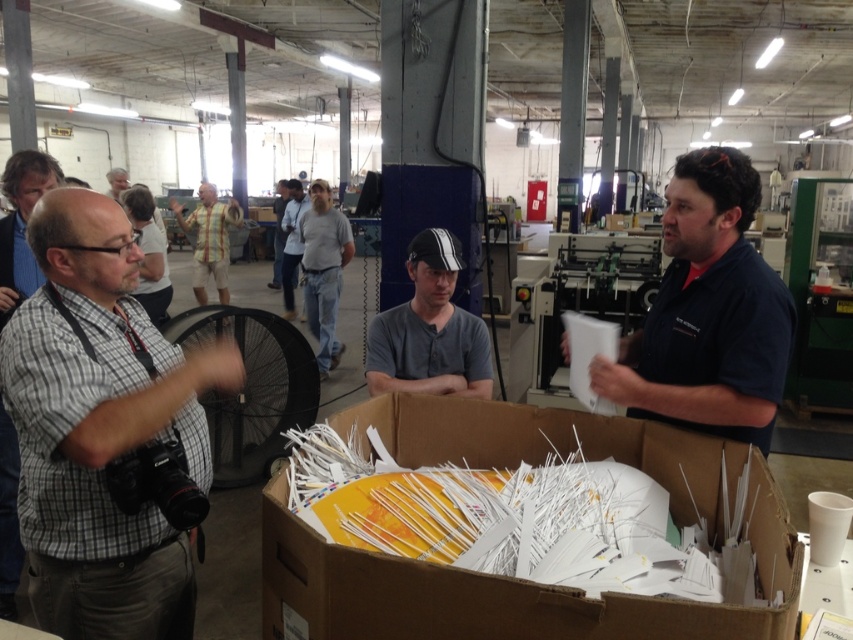
You are an inspector in this industrial setting and need to ensure that the yellow striped shirt at upper center and the light blue shirt at center are within the camera frame. Given their sizes, which shirt might be more challenging to fully capture in the photo?

The yellow striped shirt at upper center has a greater width than the light blue shirt at center, so it might be more challenging to fully capture in the photo due to its larger size.

You are an inventory manager in this industrial setting and need to determine the relative sizes of two workers to ensure proper equipment allocation. Which worker, the dark gray shirt at center or the yellow striped shirt at upper center, requires a larger uniform size?

The yellow striped shirt at upper center requires a larger uniform size because the dark gray shirt at center has a smaller size compared to it.

You are an inspector in the factory and need to ensure that the dark gray shirt at center and the yellow striped shirt at upper center are visible in your report photo. Which one is closer to the camera?

The dark gray shirt at center is closer to the camera because it is in front of the yellow striped shirt at upper center.